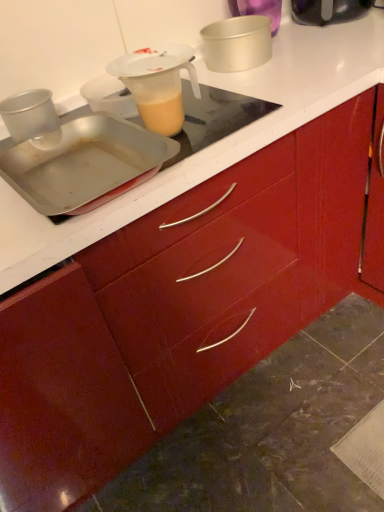
Question: Considering the relative sizes of metallic silver cup at left, which is the 2th kitchen appliance in bottom-to-top order, and translucent plastic jug at upper center in the image provided, is metallic silver cup at left, which is the 2th kitchen appliance in bottom-to-top order, bigger than translucent plastic jug at upper center?

Choices:
 (A) no
 (B) yes

Answer: (A)

Question: From a real-world perspective, is metallic silver cup at left, which appears as the first kitchen appliance when viewed from the left, on translucent plastic jug at upper center?

Choices:
 (A) no
 (B) yes

Answer: (A)

Question: Can you confirm if metallic silver cup at left, which is the 2th kitchen appliance in bottom-to-top order, is taller than translucent plastic jug at upper center?

Choices:
 (A) no
 (B) yes

Answer: (B)

Question: Is metallic silver cup at left, positioned as the third kitchen appliance in top-to-bottom order, positioned beyond the bounds of translucent plastic jug at upper center?

Choices:
 (A) no
 (B) yes

Answer: (B)

Question: From the image's perspective, would you say metallic silver cup at left, the fourth kitchen appliance positioned from the right, is shown under translucent plastic jug at upper center?

Choices:
 (A) no
 (B) yes

Answer: (B)

Question: Considering the relative sizes of metallic silver cup at left, which is the 2th kitchen appliance in bottom-to-top order, and translucent plastic jug at upper center in the image provided, is metallic silver cup at left, which is the 2th kitchen appliance in bottom-to-top order, smaller than translucent plastic jug at upper center?

Choices:
 (A) no
 (B) yes

Answer: (B)

Question: From a real-world perspective, is metallic silver cup at left, positioned as the third kitchen appliance in top-to-bottom order, beneath metallic silver cake pan at upper center, the third kitchen appliance in the left-to-right sequence?

Choices:
 (A) no
 (B) yes

Answer: (B)

Question: Considering the relative sizes of metallic silver cup at left, which is the 2th kitchen appliance in bottom-to-top order, and metallic silver cake pan at upper center, which is counted as the third kitchen appliance, starting from the bottom, in the image provided, is metallic silver cup at left, which is the 2th kitchen appliance in bottom-to-top order, wider than metallic silver cake pan at upper center, which is counted as the third kitchen appliance, starting from the bottom,?

Choices:
 (A) no
 (B) yes

Answer: (A)

Question: Does metallic silver cup at left, positioned as the third kitchen appliance in top-to-bottom order, have a smaller size compared to metallic silver cake pan at upper center, the second kitchen appliance in the top-to-bottom sequence?

Choices:
 (A) yes
 (B) no

Answer: (A)

Question: Could metallic silver cake pan at upper center, which is counted as the third kitchen appliance, starting from the bottom, be considered to be inside metallic silver cup at left, which appears as the first kitchen appliance when viewed from the left?

Choices:
 (A) yes
 (B) no

Answer: (B)

Question: From the image's perspective, would you say metallic silver cup at left, which appears as the first kitchen appliance when viewed from the left, is positioned over metallic silver cake pan at upper center, the second kitchen appliance when ordered from right to left?

Choices:
 (A) no
 (B) yes

Answer: (A)

Question: Is metallic silver cup at left, positioned as the third kitchen appliance in top-to-bottom order, taller than metallic silver cake pan at upper center, which is counted as the third kitchen appliance, starting from the bottom?

Choices:
 (A) no
 (B) yes

Answer: (A)

Question: Is metallic silver cup at left, positioned as the third kitchen appliance in top-to-bottom order, to the left of metallic silver tray at upper left, arranged as the fourth kitchen appliance when viewed from the top, from the viewer's perspective?

Choices:
 (A) yes
 (B) no

Answer: (A)